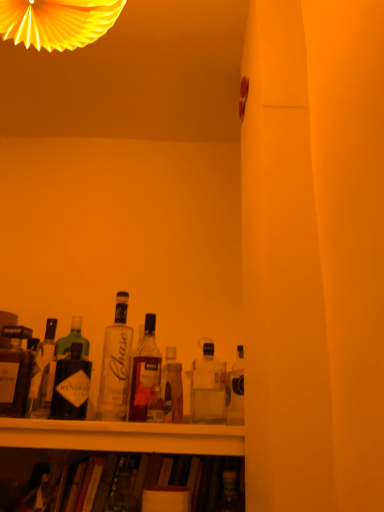
Describe the element at coordinates (116, 365) in the screenshot. This screenshot has width=384, height=512. I see `clear glass bottle at center, which is the 3th bottle from left to right` at that location.

Measure the distance between point (126, 381) and camera.

A distance of 1.13 meters exists between point (126, 381) and camera.

Image resolution: width=384 pixels, height=512 pixels. What do you see at coordinates (43, 374) in the screenshot?
I see `matte glass bottle at left, the 2th bottle from the left` at bounding box center [43, 374].

This screenshot has height=512, width=384. What do you see at coordinates (15, 372) in the screenshot?
I see `matte black bottle at left, the 1th bottle viewed from the left` at bounding box center [15, 372].

The image size is (384, 512). Describe the element at coordinates (145, 372) in the screenshot. I see `translucent glass bottle at center, marked as the 4th bottle in a left-to-right arrangement` at that location.

Where is `clear glass bottle at center, which is the 3th bottle from left to right`? This screenshot has width=384, height=512. clear glass bottle at center, which is the 3th bottle from left to right is located at coordinates (116, 365).

From the image's perspective, is clear glass bottle at center, which is the sixth bottle in left-to-right order, on top of clear glass bottle at center, which is the 3th bottle from left to right?

No.

Measure the distance from clear glass bottle at center, the 1th bottle when ordered from right to left, to clear glass bottle at center, the fourth bottle in the right-to-left sequence.

clear glass bottle at center, the 1th bottle when ordered from right to left, is 8.55 inches from clear glass bottle at center, the fourth bottle in the right-to-left sequence.

Considering the positions of points (206, 355) and (115, 357), is point (206, 355) farther from camera compared to point (115, 357)?

Yes, point (206, 355) is farther from viewer.

Find the location of a particular element. the 4th bottle above the clear glass bottle at center, which is the sixth bottle in left-to-right order (from the image's perspective) is located at coordinates (116, 365).

From a real-world perspective, does translucent glass bottle at center, marked as the 4th bottle in a left-to-right arrangement, stand above matte glass bottle at left, the fifth bottle in the right-to-left sequence?

Yes, from a real-world perspective, translucent glass bottle at center, marked as the 4th bottle in a left-to-right arrangement, is on top of matte glass bottle at left, the fifth bottle in the right-to-left sequence.

Which of these two, translucent glass bottle at center, marked as the 4th bottle in a left-to-right arrangement, or matte glass bottle at left, the fifth bottle in the right-to-left sequence, stands shorter?

With less height is matte glass bottle at left, the fifth bottle in the right-to-left sequence.

Is translucent glass bottle at center, acting as the third bottle starting from the right, not close to matte glass bottle at left, the 2th bottle from the left?

That's not correct — translucent glass bottle at center, acting as the third bottle starting from the right, is a little close to matte glass bottle at left, the 2th bottle from the left.

Which of these two, translucent glass bottle at center, marked as the 4th bottle in a left-to-right arrangement, or matte glass bottle at left, the 2th bottle from the left, is smaller?

With smaller size is matte glass bottle at left, the 2th bottle from the left.

From the image's perspective, is translucent glass bottle at center, arranged as the 2th bottle when viewed from the right, under clear glass bottle at center, which is the sixth bottle in left-to-right order?

Correct, translucent glass bottle at center, arranged as the 2th bottle when viewed from the right, appears lower than clear glass bottle at center, which is the sixth bottle in left-to-right order, in the image.

Relative to clear glass bottle at center, the 1th bottle when ordered from right to left, is translucent glass bottle at center, positioned as the 5th bottle in left-to-right order, in front or behind?

Clearly, translucent glass bottle at center, positioned as the 5th bottle in left-to-right order, is behind clear glass bottle at center, the 1th bottle when ordered from right to left.

Which object is positioned more to the left, translucent glass bottle at center, positioned as the 5th bottle in left-to-right order, or clear glass bottle at center, which is the sixth bottle in left-to-right order?

translucent glass bottle at center, positioned as the 5th bottle in left-to-right order.

From a real-world perspective, relative to matte black bottle at left, the 1th bottle viewed from the left, is clear glass bottle at center, which is the 3th bottle from left to right, vertically above or below?

Answer: In terms of real-world spatial position, clear glass bottle at center, which is the 3th bottle from left to right, is above matte black bottle at left, the 1th bottle viewed from the left.

Which is closer to the camera, (127, 373) or (1, 367)?

Point (127, 373) is positioned farther from the camera compared to point (1, 367).

Considering the relative sizes of clear glass bottle at center, which is the 3th bottle from left to right, and matte black bottle at left, marked as the 6th bottle in a right-to-left arrangement, in the image provided, is clear glass bottle at center, which is the 3th bottle from left to right, thinner than matte black bottle at left, marked as the 6th bottle in a right-to-left arrangement,?

No.

Between clear glass bottle at center, the fourth bottle in the right-to-left sequence, and matte black bottle at left, marked as the 6th bottle in a right-to-left arrangement, which one has smaller size?

matte black bottle at left, marked as the 6th bottle in a right-to-left arrangement, is smaller.

From a real-world perspective, is clear glass bottle at center, the fourth bottle in the right-to-left sequence, above or below clear glass bottle at center, which is the sixth bottle in left-to-right order?

clear glass bottle at center, the fourth bottle in the right-to-left sequence, is above clear glass bottle at center, which is the sixth bottle in left-to-right order.

Is clear glass bottle at center, the fourth bottle in the right-to-left sequence, positioned with its back to clear glass bottle at center, which is the sixth bottle in left-to-right order?

That's not correct — clear glass bottle at center, the fourth bottle in the right-to-left sequence, is not looking away from clear glass bottle at center, which is the sixth bottle in left-to-right order.

How much distance is there between clear glass bottle at center, which is the 3th bottle from left to right, and clear glass bottle at center, the 1th bottle when ordered from right to left?

clear glass bottle at center, which is the 3th bottle from left to right, and clear glass bottle at center, the 1th bottle when ordered from right to left, are 21.71 centimeters apart from each other.

Consider the image. Can you confirm if clear glass bottle at center, which is the 3th bottle from left to right, is wider than translucent glass bottle at center, arranged as the 2th bottle when viewed from the right?

Yes, clear glass bottle at center, which is the 3th bottle from left to right, is wider than translucent glass bottle at center, arranged as the 2th bottle when viewed from the right.

Which bottle is the 2nd one when counting from the right side of the clear glass bottle at center, the fourth bottle in the right-to-left sequence? Please provide its 2D coordinates.

[(172, 387)]

Does clear glass bottle at center, the fourth bottle in the right-to-left sequence, turn towards translucent glass bottle at center, arranged as the 2th bottle when viewed from the right?

No, clear glass bottle at center, the fourth bottle in the right-to-left sequence, does not turn towards translucent glass bottle at center, arranged as the 2th bottle when viewed from the right.

How different are the orientations of clear glass bottle at center, which is the 3th bottle from left to right, and translucent glass bottle at center, arranged as the 2th bottle when viewed from the right, in degrees?

There is a 0.0128-degree angle between the facing directions of clear glass bottle at center, which is the 3th bottle from left to right, and translucent glass bottle at center, arranged as the 2th bottle when viewed from the right.

Considering their positions, is translucent glass bottle at center, arranged as the 2th bottle when viewed from the right, located in front of or behind clear glass bottle at center, the fourth bottle in the right-to-left sequence?

translucent glass bottle at center, arranged as the 2th bottle when viewed from the right, is behind clear glass bottle at center, the fourth bottle in the right-to-left sequence.

Choose the correct answer: Is translucent glass bottle at center, arranged as the 2th bottle when viewed from the right, inside clear glass bottle at center, which is the 3th bottle from left to right, or outside it?

translucent glass bottle at center, arranged as the 2th bottle when viewed from the right, is outside clear glass bottle at center, which is the 3th bottle from left to right.

At what (x,y) coordinates should I click in order to perform the action: click on bottle that is the 5th one when counting downward from the clear glass bottle at center, which is the 3th bottle from left to right (from the image's perspective). Please return your answer as a coordinate pair (x, y). Image resolution: width=384 pixels, height=512 pixels. Looking at the image, I should click on (172, 387).

From the image's perspective, count 4th bottles upward from the clear glass bottle at center, which is the sixth bottle in left-to-right order, and point to it. Please provide its 2D coordinates.

[(116, 365)]

The image size is (384, 512). Identify the location of the 2nd bottle to the left when counting from the translucent glass bottle at center, marked as the 4th bottle in a left-to-right arrangement. (43, 374).

Based on their spatial positions, is matte black bottle at left, the 1th bottle viewed from the left, or translucent glass bottle at center, acting as the third bottle starting from the right, further from clear glass bottle at center, the 1th bottle when ordered from right to left?

matte black bottle at left, the 1th bottle viewed from the left, is positioned further to the anchor clear glass bottle at center, the 1th bottle when ordered from right to left.

Based on their spatial positions, is clear glass bottle at center, which is the 3th bottle from left to right, or matte glass bottle at left, the fifth bottle in the right-to-left sequence, closer to matte black bottle at left, marked as the 6th bottle in a right-to-left arrangement?

Among the two, matte glass bottle at left, the fifth bottle in the right-to-left sequence, is located nearer to matte black bottle at left, marked as the 6th bottle in a right-to-left arrangement.

Considering their positions, is translucent glass bottle at center, arranged as the 2th bottle when viewed from the right, positioned further to clear glass bottle at center, the 1th bottle when ordered from right to left, than matte black bottle at left, the 1th bottle viewed from the left?

matte black bottle at left, the 1th bottle viewed from the left, lies further to clear glass bottle at center, the 1th bottle when ordered from right to left, than the other object.

In the scene shown: From the image, which object appears to be nearer to translucent glass bottle at center, acting as the third bottle starting from the right, translucent glass bottle at center, arranged as the 2th bottle when viewed from the right, or matte black bottle at left, marked as the 6th bottle in a right-to-left arrangement?

translucent glass bottle at center, arranged as the 2th bottle when viewed from the right, is positioned closer to the anchor translucent glass bottle at center, acting as the third bottle starting from the right.

Estimate the real-world distances between objects in this image. Which object is further from clear glass bottle at center, the 1th bottle when ordered from right to left, clear glass bottle at center, the fourth bottle in the right-to-left sequence, or translucent glass bottle at center, acting as the third bottle starting from the right?

clear glass bottle at center, the fourth bottle in the right-to-left sequence, is positioned further to the anchor clear glass bottle at center, the 1th bottle when ordered from right to left.

From the image, which object appears to be farther from translucent glass bottle at center, positioned as the 5th bottle in left-to-right order, clear glass bottle at center, which is the 3th bottle from left to right, or translucent glass bottle at center, acting as the third bottle starting from the right?

clear glass bottle at center, which is the 3th bottle from left to right, lies further to translucent glass bottle at center, positioned as the 5th bottle in left-to-right order, than the other object.

Based on their spatial positions, is clear glass bottle at center, the fourth bottle in the right-to-left sequence, or translucent glass bottle at center, arranged as the 2th bottle when viewed from the right, closer to translucent glass bottle at center, acting as the third bottle starting from the right?

The object closer to translucent glass bottle at center, acting as the third bottle starting from the right, is clear glass bottle at center, the fourth bottle in the right-to-left sequence.

Considering their positions, is matte black bottle at left, the 1th bottle viewed from the left, positioned further to translucent glass bottle at center, marked as the 4th bottle in a left-to-right arrangement, than clear glass bottle at center, the fourth bottle in the right-to-left sequence?

Based on the image, matte black bottle at left, the 1th bottle viewed from the left, appears to be further to translucent glass bottle at center, marked as the 4th bottle in a left-to-right arrangement.

I want to click on bottle between clear glass bottle at center, which is the 3th bottle from left to right, and translucent glass bottle at center, positioned as the 5th bottle in left-to-right order, from left to right, so click(x=145, y=372).

The height and width of the screenshot is (512, 384). In order to click on bottle between matte glass bottle at left, the 2th bottle from the left, and translucent glass bottle at center, marked as the 4th bottle in a left-to-right arrangement, in the horizontal direction in this screenshot , I will do `click(116, 365)`.

This screenshot has height=512, width=384. I want to click on bottle located between matte black bottle at left, the 1th bottle viewed from the left, and clear glass bottle at center, the fourth bottle in the right-to-left sequence, in the left-right direction, so click(x=43, y=374).

You are a GUI agent. You are given a task and a screenshot of the screen. Output one action in this format:
    pyautogui.click(x=<x>, y=<y>)
    Task: Click on the bottle situated between translucent glass bottle at center, marked as the 4th bottle in a left-to-right arrangement, and clear glass bottle at center, the 1th bottle when ordered from right to left, from left to right
    This screenshot has height=512, width=384.
    Given the screenshot: What is the action you would take?
    pyautogui.click(x=172, y=387)